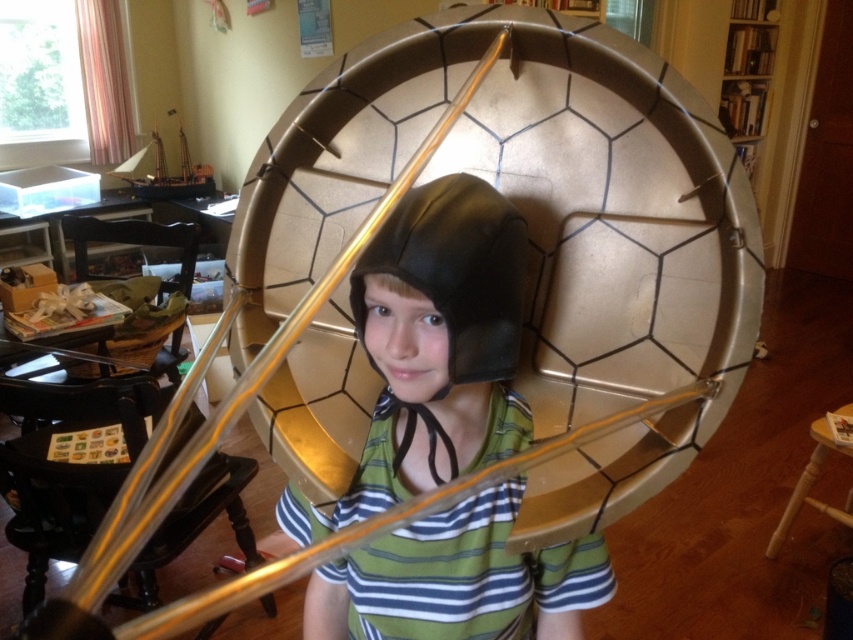
From the picture: You are a costume designer trying to place a 12 cm wide ribbon between the matte black helmet at center and the black leather helmet at center. Can you fit the ribbon between them?

The distance between the matte black helmet at center and the black leather helmet at center is 11.26 centimeters, which is less than the 12 cm width of the ribbon. Therefore, the ribbon cannot fit between them.

You are a character in a game and need to choose between the matte black helmet at center and the black leather helmet at center. Which one is positioned to the right?

The matte black helmet at center is positioned to the right of the black leather helmet at center.